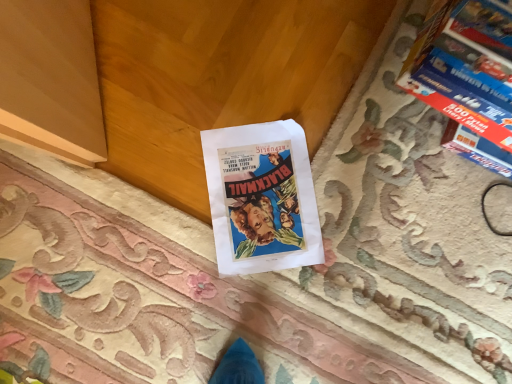
The width and height of the screenshot is (512, 384). Identify the location of free location in front of vintage paper poster at center. (193, 288).